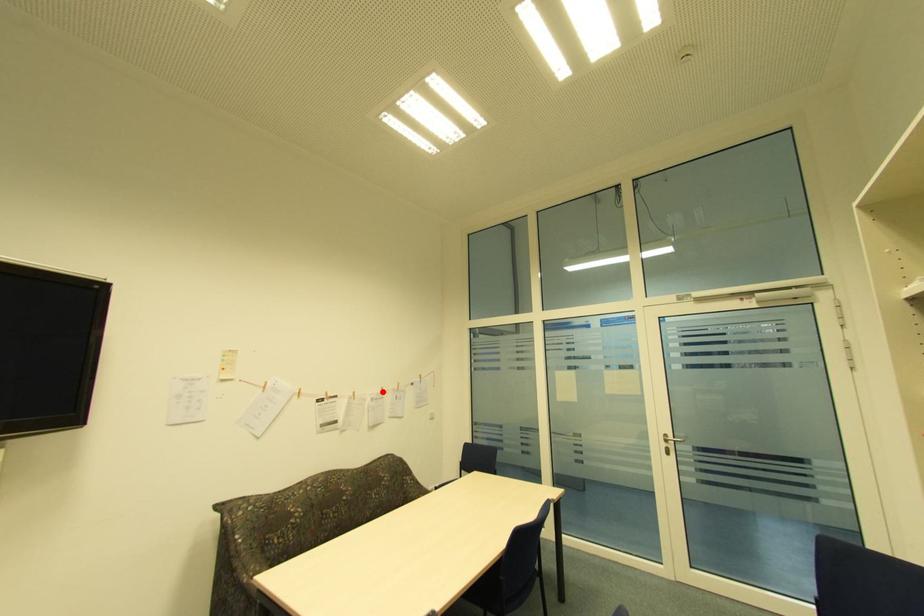
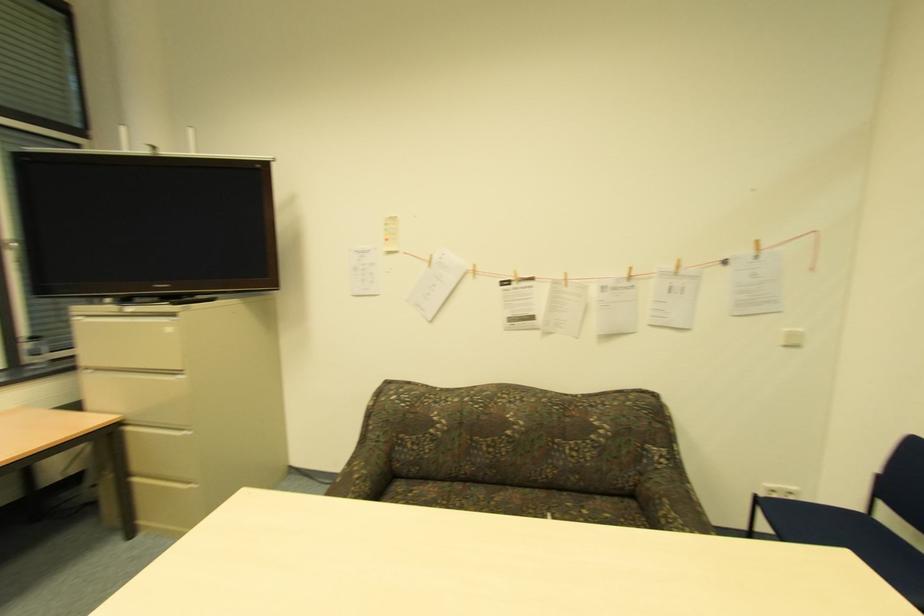
Question: I am providing you with two images of the same scene from different viewpoints. Given a red point in image1, look at the same physical point in image2. Is it:

Choices:
 (A) Closer to the viewpoint
 (B) Farther from the viewpoint

Answer: (A)